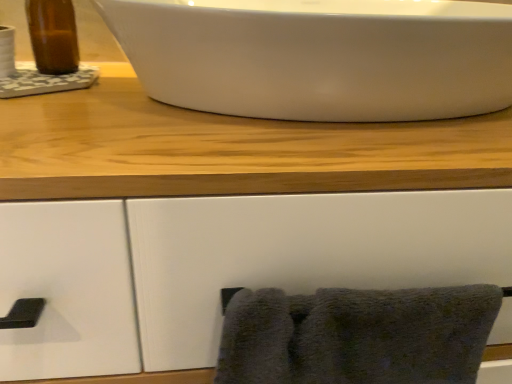
Image resolution: width=512 pixels, height=384 pixels. Find the location of `vacant area that is situated to the right of brown glass bottle at upper left, the 1th sink when ordered from left to right`. vacant area that is situated to the right of brown glass bottle at upper left, the 1th sink when ordered from left to right is located at coordinates (126, 83).